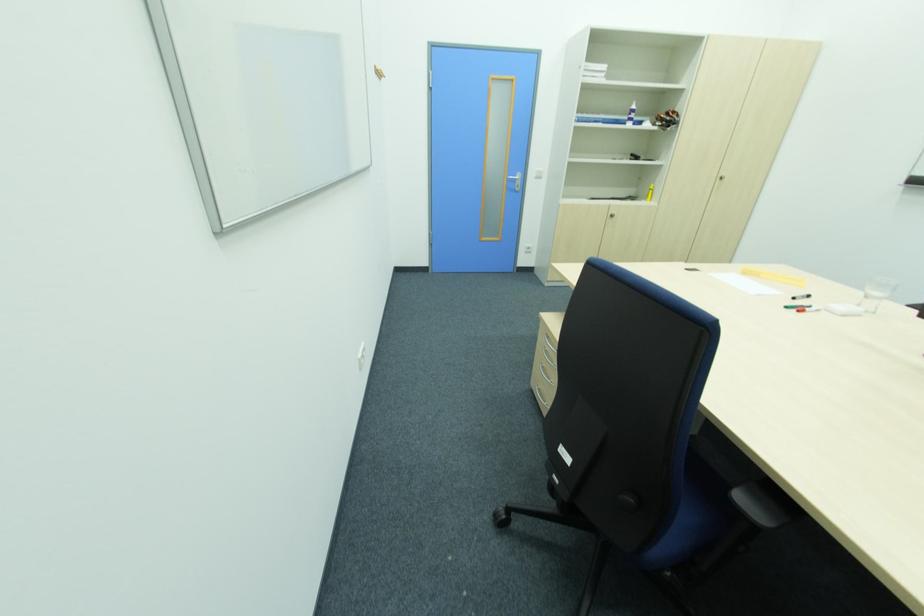
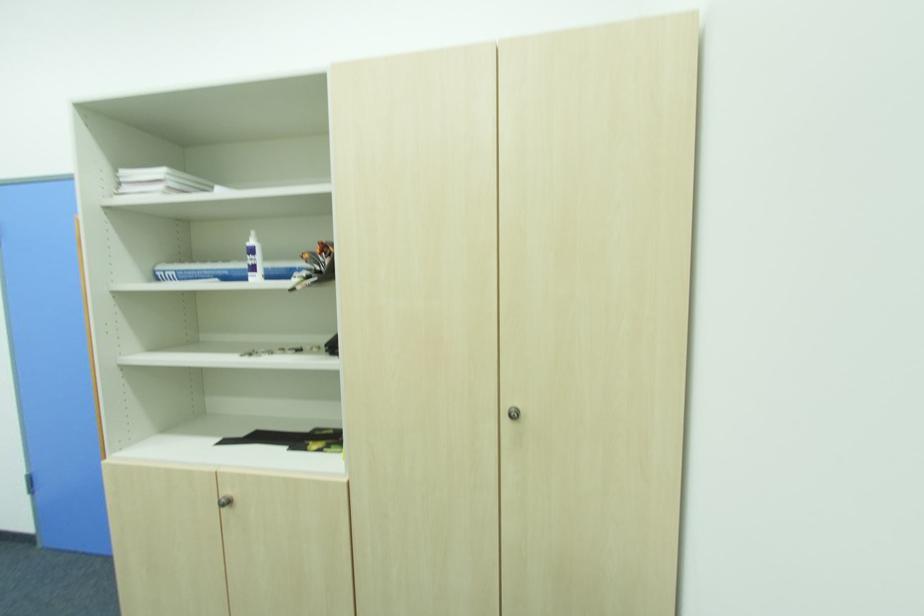
Where in the second image is the point corresponding to (606,67) from the first image?

(161, 172)